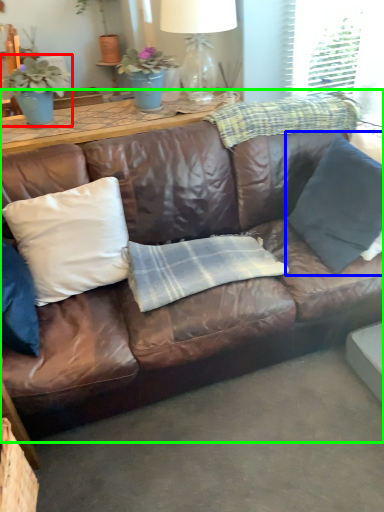
Question: Which object is positioned closest to houseplant (highlighted by a red box)? Select from pillow (highlighted by a blue box) and studio couch (highlighted by a green box).

Choices:
 (A) pillow
 (B) studio couch

Answer: (B)